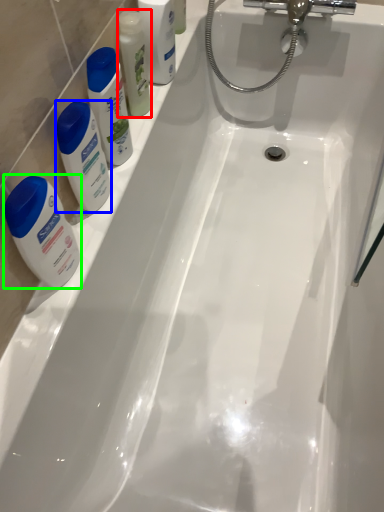
Question: Estimate the real-world distances between objects in this image. Which object is farther from mouthwash (highlighted by a red box), cleaning product (highlighted by a blue box) or toiletry (highlighted by a green box)?

Choices:
 (A) cleaning product
 (B) toiletry

Answer: (B)